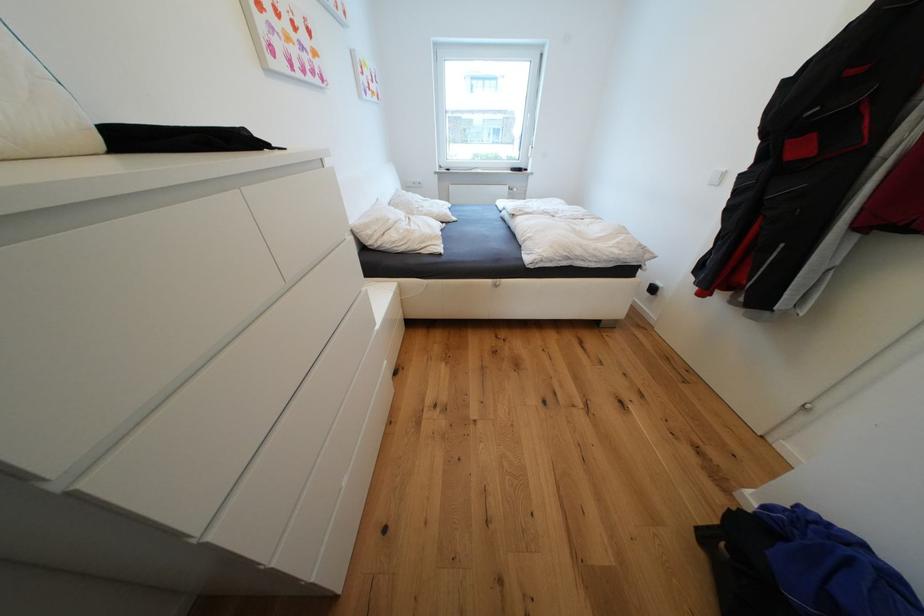
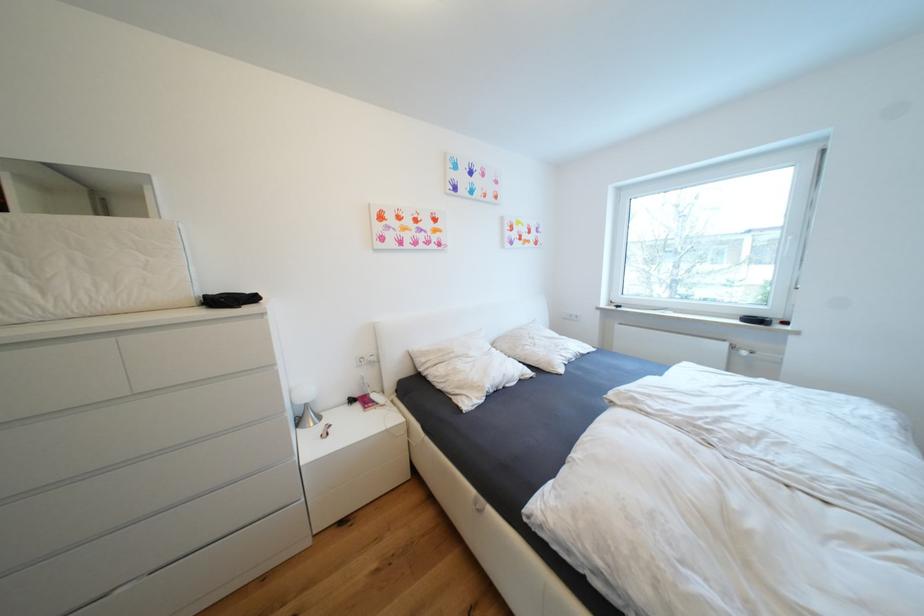
Locate, in the second image, the point that corresponds to the point at 515,188 in the first image.

(733, 346)